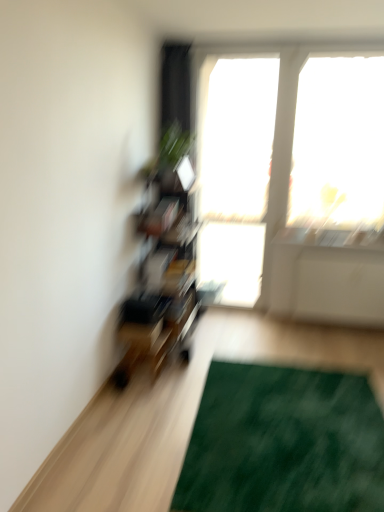
Question: In terms of width, does green leafy plant at upper center look wider or thinner when compared to green textured mat at lower right?

Choices:
 (A) wide
 (B) thin

Answer: (B)

Question: Is point (182, 146) closer or farther from the camera than point (379, 413)?

Choices:
 (A) closer
 (B) farther

Answer: (B)

Question: Which object is positioned closest to the transparent glass window at center, which is counted as the second window screen, starting from the right?

Choices:
 (A) green leafy plant at upper center
 (B) transparent glass window at upper right, the 2th window screen in the left-to-right sequence
 (C) green textured mat at lower right

Answer: (B)

Question: Which is farther from the transparent glass window at upper right, which appears as the first window screen when viewed from the right?

Choices:
 (A) green leafy plant at upper center
 (B) transparent glass window at center, which is counted as the second window screen, starting from the right
 (C) green textured mat at lower right

Answer: (C)